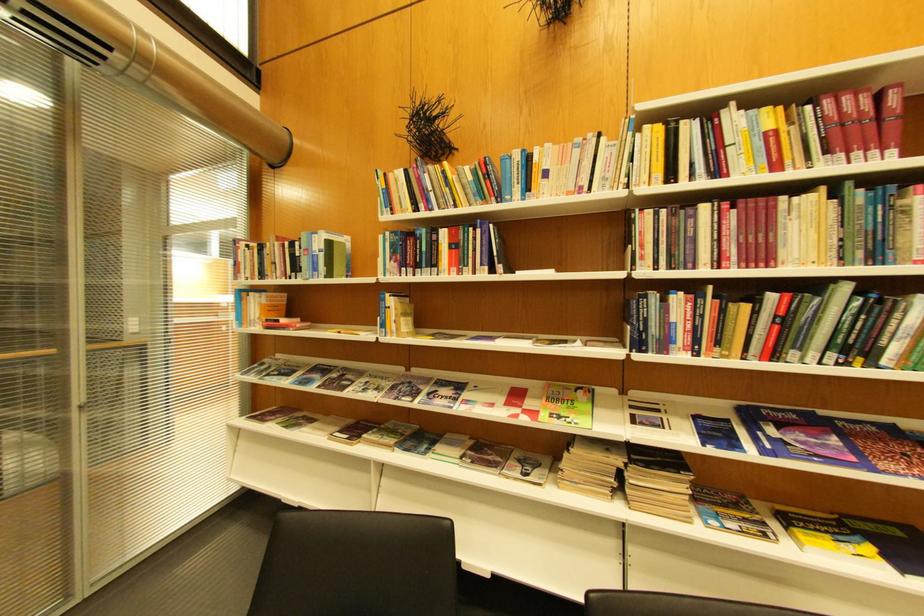
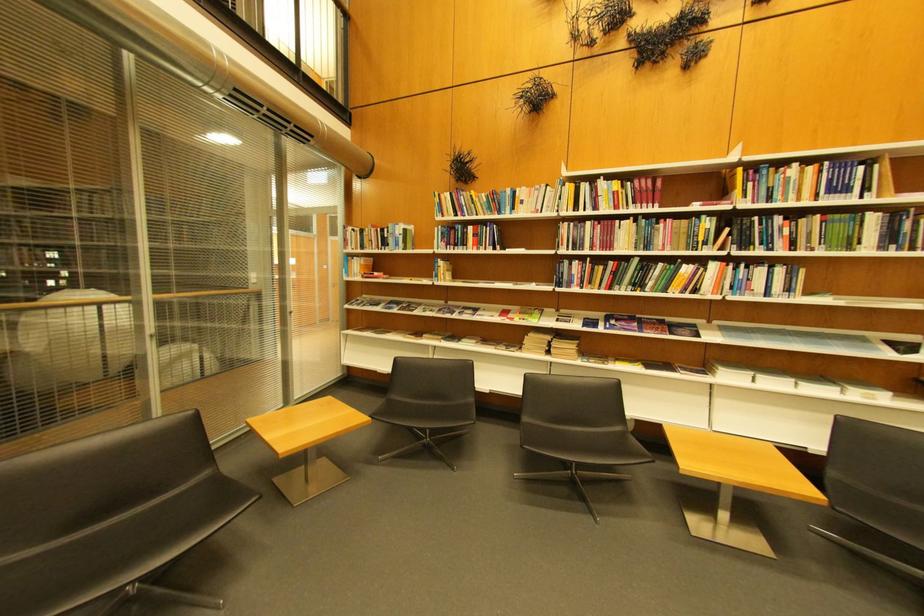
The point at (528,191) is marked in the first image. Where is the corresponding point in the second image?

(518, 209)